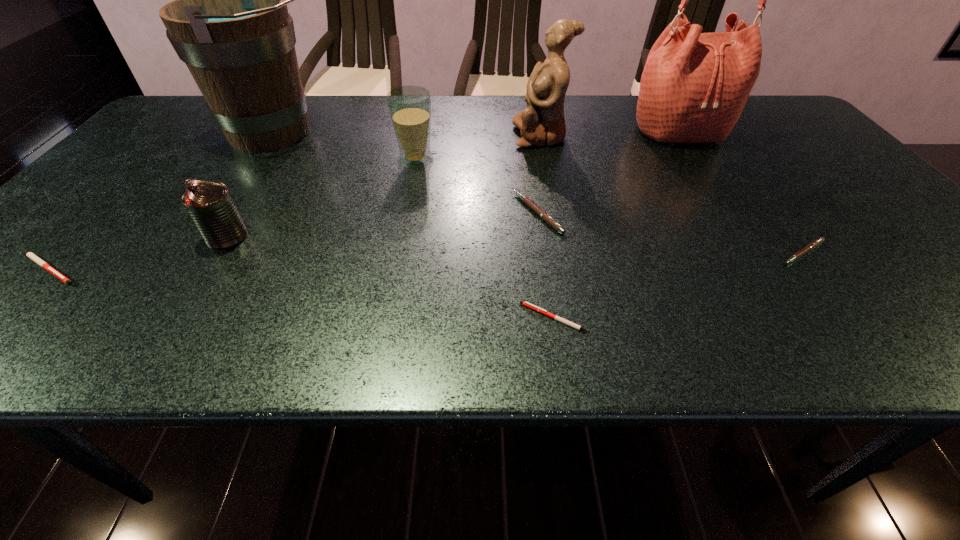
The height and width of the screenshot is (540, 960). I want to click on object that is at the near edge, so click(529, 305).

The width and height of the screenshot is (960, 540). Identify the location of blank space at the far edge of the desktop. (597, 115).

In the image, there is a desktop. Where is `vacant space at the near edge`? The image size is (960, 540). vacant space at the near edge is located at coordinates 679,345.

The width and height of the screenshot is (960, 540). In order to click on vacant position at the left edge of the desktop in this screenshot , I will do `click(117, 172)`.

Where is `vacant area at the right edge`? The image size is (960, 540). vacant area at the right edge is located at coordinates (875, 219).

Where is `empty location between the farthest pen and the handbag`? The image size is (960, 540). empty location between the farthest pen and the handbag is located at coordinates (610, 173).

Where is `free area in between the right pink pen and the can`? free area in between the right pink pen and the can is located at coordinates (515, 245).

Image resolution: width=960 pixels, height=540 pixels. Identify the location of free area in between the handbag and the nearer pink pen. (742, 193).

Where is `vacant area that lies between the tallest object and the tallest pen`? The height and width of the screenshot is (540, 960). vacant area that lies between the tallest object and the tallest pen is located at coordinates (610, 173).

The image size is (960, 540). In order to click on vacant point located between the fifth tallest object and the nearest object in this screenshot , I will do `click(391, 278)`.